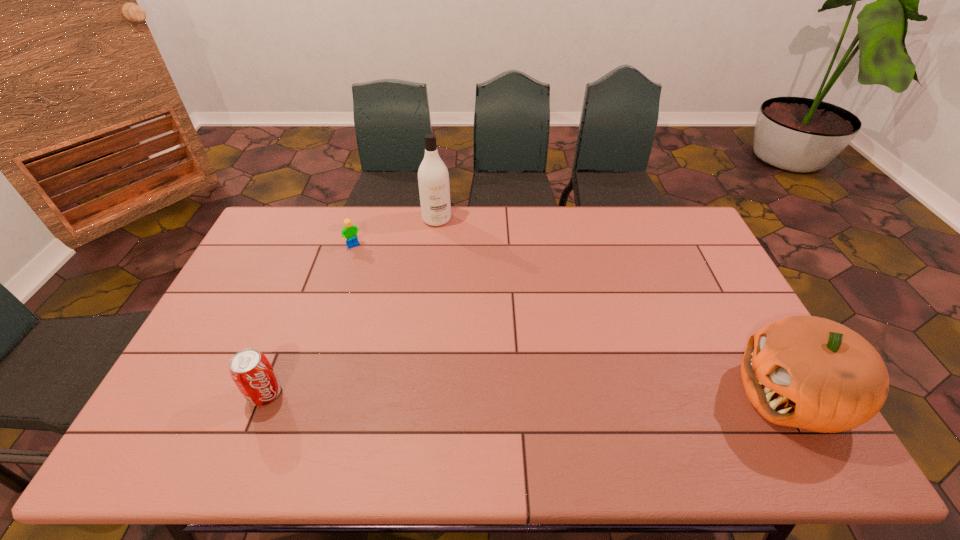
This screenshot has width=960, height=540. Find the location of `vacant space on the desktop that is between the soda and the rightmost object and is positioned on the face of the Lego`. vacant space on the desktop that is between the soda and the rightmost object and is positioned on the face of the Lego is located at coordinates (472, 394).

Find the location of a particular element. vacant space on the desktop that is between the soda and the rightmost object and is positioned on the front-facing side of the second object from right to left is located at coordinates (487, 394).